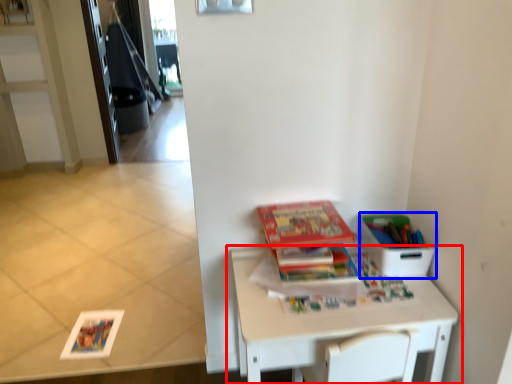
Question: Which of the following is the farthest to the observer, table (highlighted by a red box) or cardboard box (highlighted by a blue box)?

Choices:
 (A) table
 (B) cardboard box

Answer: (B)